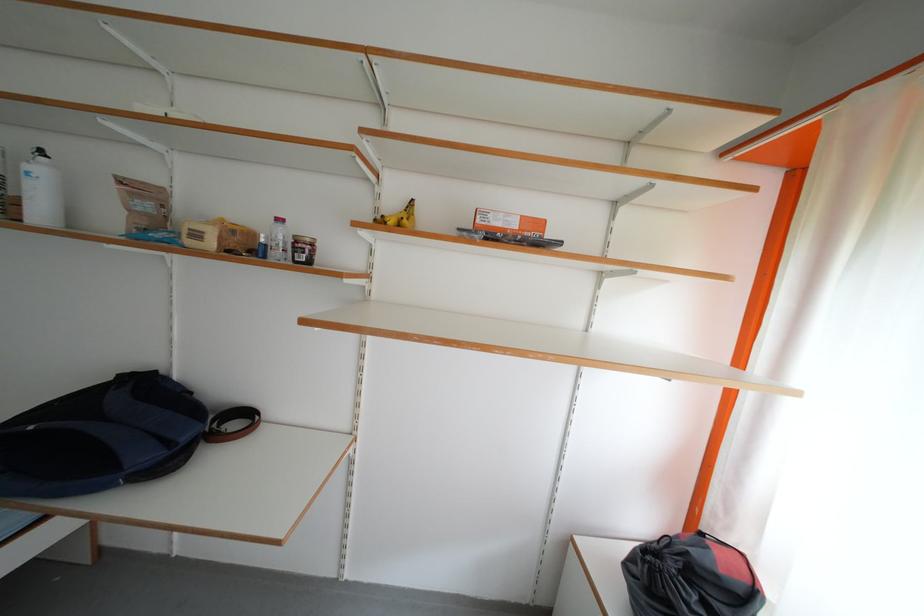
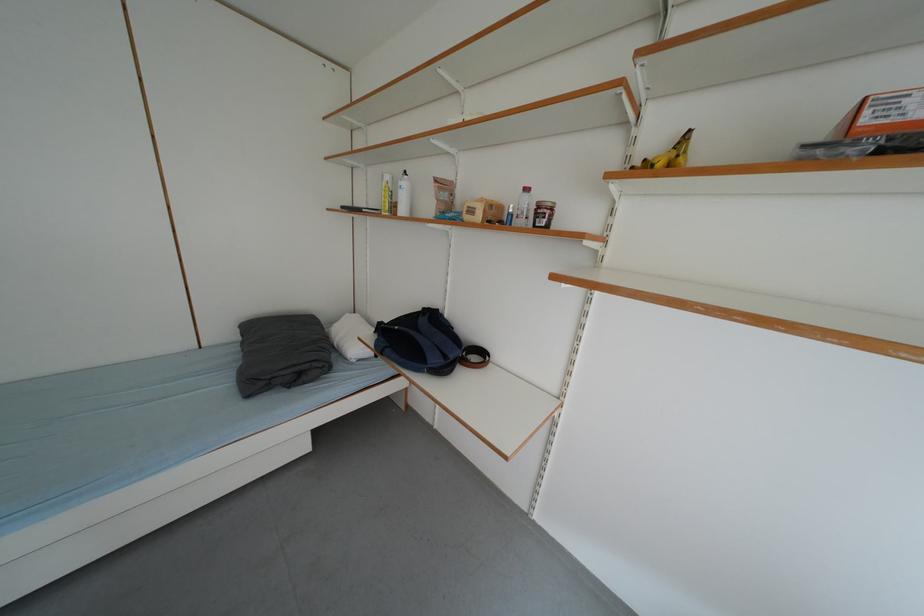
In the second image, find the point that corresponds to (x=220, y=248) in the first image.

(487, 220)